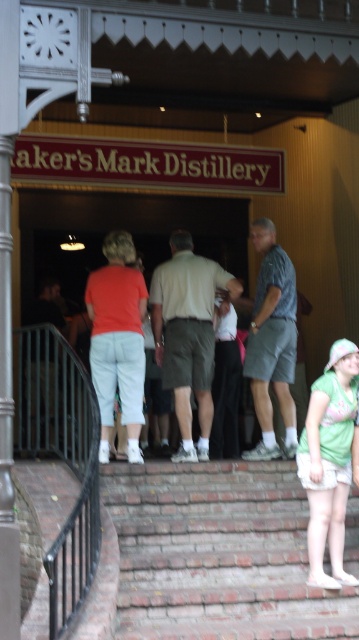
You are standing at the entrance of Maker s Mark Distillery and want to greet someone wearing the matte gray shirt at center. The black metal railing at lower left is in your way. Can you walk around it to reach them?

The distance between the black metal railing at lower left and matte gray shirt at center is 14.07 inches, which is too narrow to walk around. You will need to find another path or ask the person to move closer.